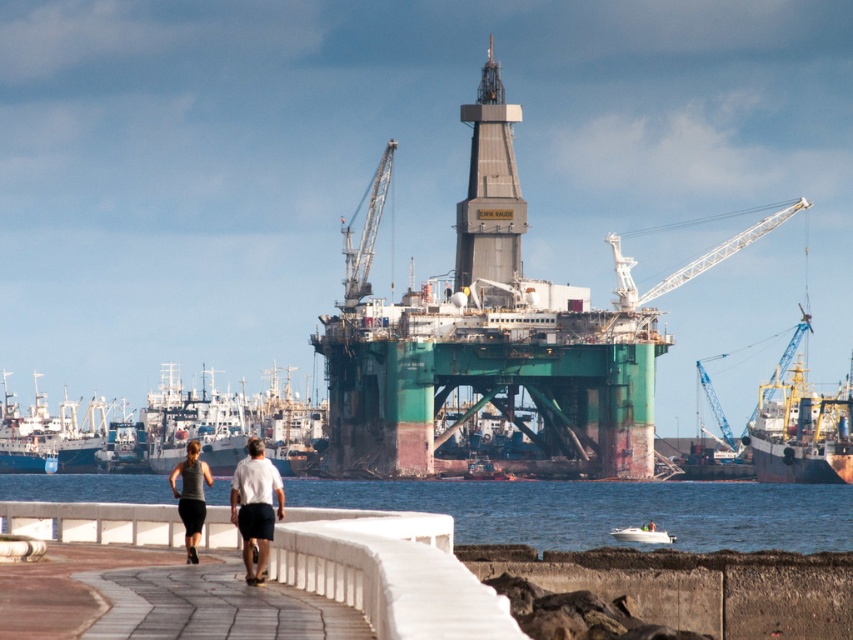
Does metallic gray crane at center have a greater height compared to dark gray fabric leggings at lower left?

Yes.

Image resolution: width=853 pixels, height=640 pixels. Describe the element at coordinates (364, 230) in the screenshot. I see `metallic gray crane at center` at that location.

The image size is (853, 640). In order to click on metallic gray crane at center in this screenshot , I will do `click(364, 230)`.

Is white metallic crane at upper center wider than white glossy boat at lower center?

Yes.

Identify the location of white metallic crane at upper center. The height and width of the screenshot is (640, 853). (692, 260).

Is point (236, 625) less distant than point (479, 292)?

That is True.

Is point (293, 608) positioned behind point (496, 177)?

No, (293, 608) is closer to viewer.

Between point (161, 588) and point (489, 228), which one is positioned in front?

Point (161, 588) is in front.

At what (x,y) coordinates should I click in order to perform the action: click on paved stone walkway at lower center. Please return your answer as a coordinate pair (x, y). This screenshot has height=640, width=853. Looking at the image, I should click on (213, 605).